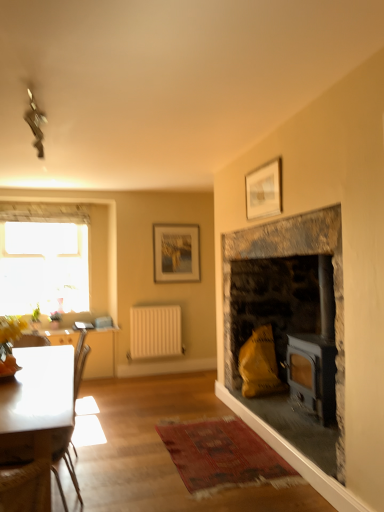
Question: Can white glossy coffee table at lower left be found inside transparent glass window at upper left?

Choices:
 (A) no
 (B) yes

Answer: (A)

Question: Is transparent glass window at upper left turned away from white glossy coffee table at lower left?

Choices:
 (A) yes
 (B) no

Answer: (B)

Question: Is the position of transparent glass window at upper left more distant than that of white glossy coffee table at lower left?

Choices:
 (A) no
 (B) yes

Answer: (B)

Question: Is transparent glass window at upper left completely or partially outside of white glossy coffee table at lower left?

Choices:
 (A) yes
 (B) no

Answer: (A)

Question: Is transparent glass window at upper left touching white glossy coffee table at lower left?

Choices:
 (A) no
 (B) yes

Answer: (A)

Question: Looking at their shapes, would you say stone fireplace at right is wider or thinner than matte wooden picture frame at upper center, positioned as the 1th picture frame in bottom-to-top order?

Choices:
 (A) thin
 (B) wide

Answer: (B)

Question: Does point (283, 256) appear closer or farther from the camera than point (173, 237)?

Choices:
 (A) farther
 (B) closer

Answer: (B)

Question: Which is correct: stone fireplace at right is inside matte wooden picture frame at upper center, marked as the first picture frame in a left-to-right arrangement, or outside of it?

Choices:
 (A) outside
 (B) inside

Answer: (A)

Question: From a real-world perspective, is stone fireplace at right positioned above or below matte wooden picture frame at upper center, the first picture frame from the back?

Choices:
 (A) above
 (B) below

Answer: (B)

Question: Considering the relative positions of white matte radiator at center and white glossy table at left in the image provided, is white matte radiator at center to the left or to the right of white glossy table at left?

Choices:
 (A) left
 (B) right

Answer: (B)

Question: Considering the positions of white matte radiator at center and white glossy table at left in the image, is white matte radiator at center wider or thinner than white glossy table at left?

Choices:
 (A) wide
 (B) thin

Answer: (B)

Question: From the image's perspective, is white matte radiator at center positioned above or below white glossy table at left?

Choices:
 (A) below
 (B) above

Answer: (B)

Question: Is white matte radiator at center situated inside white glossy table at left or outside?

Choices:
 (A) inside
 (B) outside

Answer: (B)

Question: Based on their sizes in the image, would you say white glossy table at left is bigger or smaller than white matte radiator at center?

Choices:
 (A) big
 (B) small

Answer: (A)

Question: Is white glossy table at left in front of or behind white matte radiator at center in the image?

Choices:
 (A) front
 (B) behind

Answer: (A)